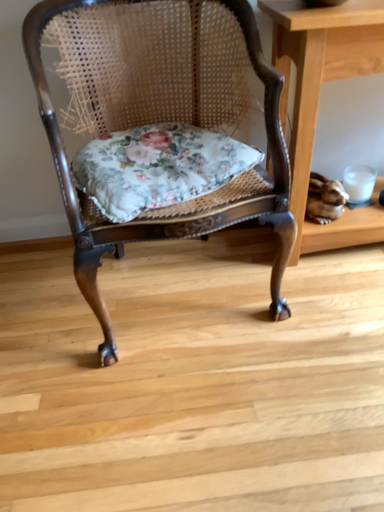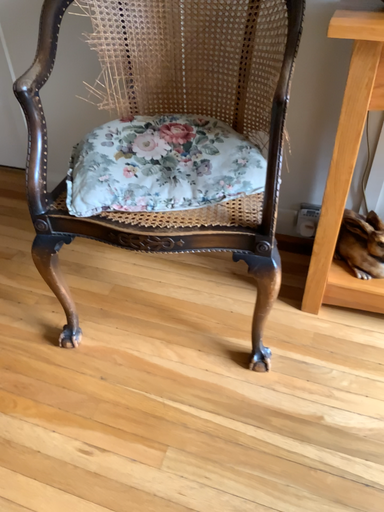
Question: Which way did the camera rotate in the video?

Choices:
 (A) rotated right
 (B) rotated left

Answer: (B)